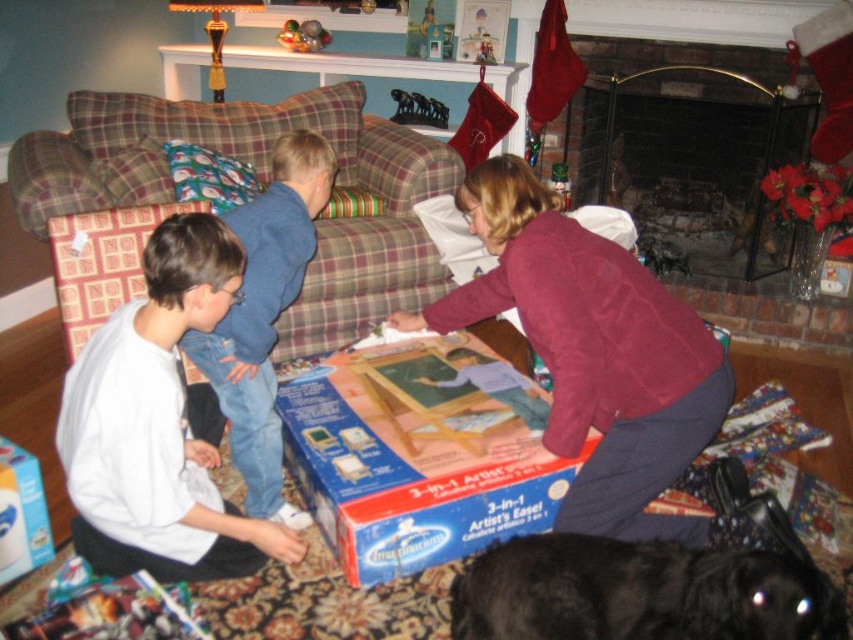
Question: Which of the following is the closest to the observer?

Choices:
 (A) (10, 512)
 (B) (198, 529)

Answer: (B)

Question: Which object is farther from the camera taking this photo?

Choices:
 (A) velvet red stocking at center
 (B) metallic silver toy at upper center

Answer: (B)

Question: Is brick fireplace at right positioned behind black fur dog at lower right?

Choices:
 (A) no
 (B) yes

Answer: (B)

Question: Which point appears closest to the camera in this image?

Choices:
 (A) (283, 24)
 (B) (563, 236)
 (C) (142, 548)
 (D) (28, 474)

Answer: (B)

Question: Does blue cardboard box at center appear on the right side of metallic silver toy at upper center?

Choices:
 (A) no
 (B) yes

Answer: (B)

Question: In this image, where is velvet red stocking at center located relative to metallic silver toy at upper center?

Choices:
 (A) left
 (B) right

Answer: (B)